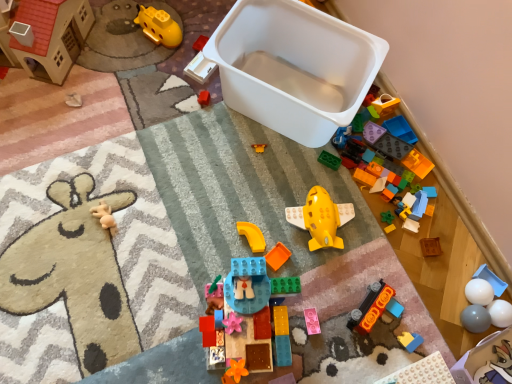
The width and height of the screenshot is (512, 384). In order to click on vacant space that's between yellow matte airplane at center, the 8th toy from the left, and white plastic tray at upper center, placed as the 13th toy when sorted from right to left in this screenshot , I will do `click(260, 156)`.